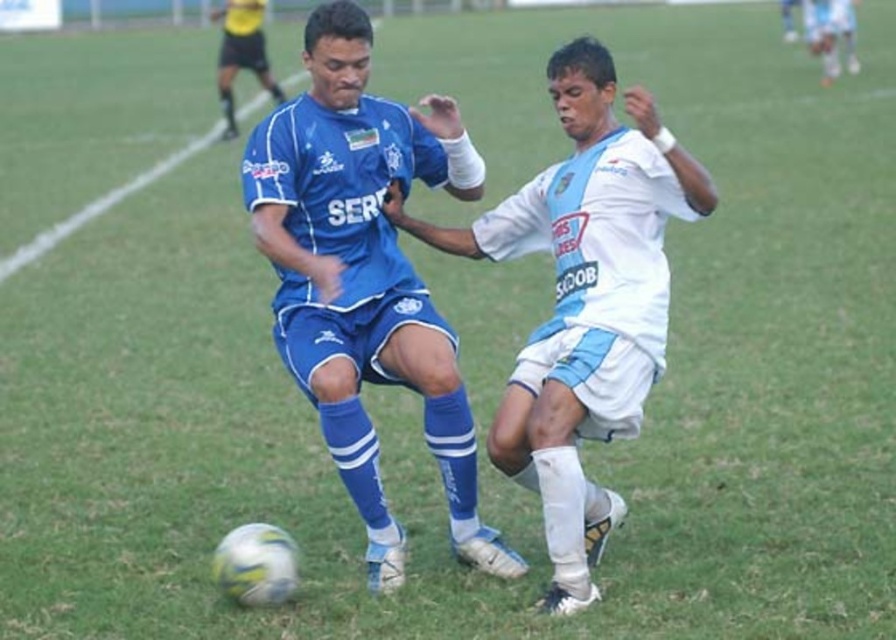
Can you confirm if matte blue jersey at center is thinner than white matte soccer player at center?

Yes.

Does point (354, 502) come behind point (565, 544)?

Yes, point (354, 502) is farther from viewer.

Locate an element on the screen. The width and height of the screenshot is (896, 640). matte blue jersey at center is located at coordinates (365, 276).

Locate an element on the screen. This screenshot has height=640, width=896. matte blue jersey at center is located at coordinates (365, 276).